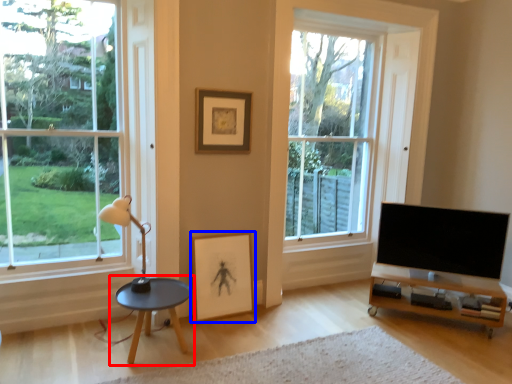
Question: Which of the following is the closest to the observer, coffee table (highlighted by a red box) or picture frame (highlighted by a blue box)?

Choices:
 (A) coffee table
 (B) picture frame

Answer: (A)